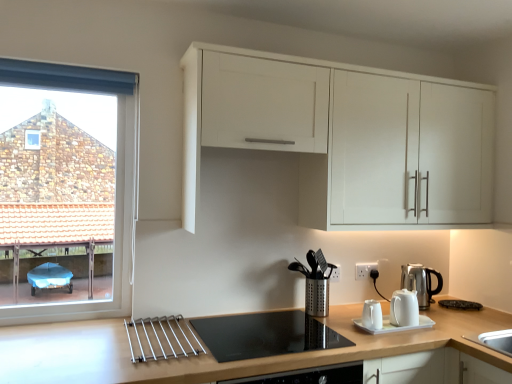
At what (x,y) coordinates should I click in order to perform the action: click on white matte cabinet at upper center. Please return your answer as a coordinate pair (x, y). Looking at the image, I should click on (346, 136).

In order to face silver metallic coffee machine at center, should I rotate leftwards or rightwards?

A 8.115 degree turn to the right will do.

What do you see at coordinates (265, 335) in the screenshot?
I see `black glass cooktop at center` at bounding box center [265, 335].

Measure the distance between point [374,264] and camera.

Point [374,264] is 2.38 meters from camera.

Locate an element on the screen. white matte cabinet at upper center is located at coordinates (346, 136).

Identify the location of the 1st kitchen appliance located above the light brown wood at lower center (from a real-world perspective). (372, 315).

Considering the sizes of objects white glossy teapot at center, the first kitchen appliance from the left, and light brown wood at lower center in the image provided, who is taller, white glossy teapot at center, the first kitchen appliance from the left, or light brown wood at lower center?

Standing taller between the two is light brown wood at lower center.

From the image's perspective, is white glossy teapot at center, the first kitchen appliance when ordered from front to back, above or below light brown wood at lower center?

Based on their image positions, white glossy teapot at center, the first kitchen appliance when ordered from front to back, is located above light brown wood at lower center.

Based on their positions, is white glossy teapot at center, the second kitchen appliance from the right, located to the left or right of light brown wood at lower center?

white glossy teapot at center, the second kitchen appliance from the right, is to the right of light brown wood at lower center.

Which is farther from the camera, (429,277) or (360,270)?

The point (360,270) is farther.

Can you confirm if silver metallic kettle at right, which is the 2th kitchen appliance in left-to-right order, is shorter than white plastic electric outlet at lower right?

Incorrect, the height of silver metallic kettle at right, which is the 2th kitchen appliance in left-to-right order, does not fall short of that of white plastic electric outlet at lower right.

From a real-world perspective, is silver metallic kettle at right, arranged as the second kitchen appliance when viewed from the front, physically above white plastic electric outlet at lower right?

No.

From the picture: Can you confirm if silver metallic kettle at right, arranged as the second kitchen appliance when viewed from the front, is smaller than white plastic electric outlet at lower right?

No, silver metallic kettle at right, arranged as the second kitchen appliance when viewed from the front, is not smaller than white plastic electric outlet at lower right.

Between white glossy teapot at center, the first kitchen appliance from the left, and white plastic electric outlet at lower right, which one appears on the left side from the viewer's perspective?

From the viewer's perspective, white glossy teapot at center, the first kitchen appliance from the left, appears more on the left side.

Does point (375, 325) lie behind point (366, 263)?

No, it is not.

Is white glossy teapot at center, the second kitchen appliance from the right, turned away from white plastic electric outlet at lower right?

That's not correct — white glossy teapot at center, the second kitchen appliance from the right, is not looking away from white plastic electric outlet at lower right.

Could you tell me if silver metallic kettle at right, arranged as the second kitchen appliance when viewed from the front, is facing silver metallic coffee machine at center?

No, silver metallic kettle at right, arranged as the second kitchen appliance when viewed from the front, does not turn towards silver metallic coffee machine at center.

Is silver metallic kettle at right, arranged as the second kitchen appliance when viewed from the front, bigger or smaller than silver metallic coffee machine at center?

silver metallic kettle at right, arranged as the second kitchen appliance when viewed from the front, is smaller than silver metallic coffee machine at center.

From the picture: Considering the relative positions of silver metallic kettle at right, which appears as the first kitchen appliance when viewed from the back, and silver metallic coffee machine at center in the image provided, is silver metallic kettle at right, which appears as the first kitchen appliance when viewed from the back, to the left of silver metallic coffee machine at center from the viewer's perspective?

No.

Looking at this image, from their relative heights in the image, would you say silver metallic kettle at right, which appears as the first kitchen appliance when viewed from the back, is taller or shorter than silver metallic coffee machine at center?

Considering their sizes, silver metallic kettle at right, which appears as the first kitchen appliance when viewed from the back, has less height than silver metallic coffee machine at center.

Consider the image. Is silver metallic kettle at right, arranged as the first kitchen appliance when viewed from the right, not inside clear glass window at left?

That's correct, silver metallic kettle at right, arranged as the first kitchen appliance when viewed from the right, is outside of clear glass window at left.

Can you tell me how much silver metallic kettle at right, which is the 2th kitchen appliance in left-to-right order, and clear glass window at left differ in facing direction?

The facing directions of silver metallic kettle at right, which is the 2th kitchen appliance in left-to-right order, and clear glass window at left are 4 degrees apart.

The height and width of the screenshot is (384, 512). I want to click on window that appears above the silver metallic kettle at right, which is the 2th kitchen appliance in left-to-right order (from the image's perspective), so tap(66, 191).

Is the depth of silver metallic kettle at right, arranged as the first kitchen appliance when viewed from the right, greater than that of clear glass window at left?

Yes, it is behind clear glass window at left.

Is black glass cooktop at center aimed at silver metallic coffee machine at center?

No, black glass cooktop at center is not facing towards silver metallic coffee machine at center.

Does point (301, 341) appear closer or farther from the camera than point (302, 264)?

Point (301, 341) is closer to the camera than point (302, 264).

Considering the relative positions of black glass cooktop at center and silver metallic coffee machine at center in the image provided, is black glass cooktop at center to the left of silver metallic coffee machine at center from the viewer's perspective?

Indeed, black glass cooktop at center is positioned on the left side of silver metallic coffee machine at center.

Considering the relative sizes of black glass cooktop at center and silver metallic coffee machine at center in the image provided, is black glass cooktop at center bigger than silver metallic coffee machine at center?

Incorrect, black glass cooktop at center is not larger than silver metallic coffee machine at center.

Is light brown wood at lower center closer to the viewer compared to white matte cabinet at upper center?

Yes, light brown wood at lower center is in front of white matte cabinet at upper center.

Are light brown wood at lower center and white matte cabinet at upper center beside each other?

There is a gap between light brown wood at lower center and white matte cabinet at upper center.

In the scene shown: Considering the relative positions of light brown wood at lower center and white matte cabinet at upper center in the image provided, is light brown wood at lower center to the right of white matte cabinet at upper center from the viewer's perspective?

No, light brown wood at lower center is not to the right of white matte cabinet at upper center.

How far apart are light brown wood at lower center and white matte cabinet at upper center?

light brown wood at lower center and white matte cabinet at upper center are 79.16 centimeters apart.

From a real-world perspective, count 1st kitchen appliances upward from the light brown wood at lower center and point to it. Please provide its 2D coordinates.

[(372, 315)]

I want to click on kitchen appliance on the right side of white plastic electric outlet at lower right, so click(421, 283).

From the image, which object appears to be farther from clear glass window at left, white plastic electric outlet at lower right or white glossy teapot at center, the first kitchen appliance from the left?

Based on the image, white plastic electric outlet at lower right appears to be further to clear glass window at left.

Which object lies nearer to the anchor point silver metallic coffee machine at center, clear glass window at left or white matte cabinet at upper center?

white matte cabinet at upper center is positioned closer to the anchor silver metallic coffee machine at center.

Based on their spatial positions, is clear glass window at left or light brown wood at lower center closer to silver metallic coffee machine at center?

The object closer to silver metallic coffee machine at center is light brown wood at lower center.

Considering their positions, is silver metallic kettle at right, arranged as the second kitchen appliance when viewed from the front, positioned further to black glass cooktop at center than light brown wood at lower center?

The object further to black glass cooktop at center is silver metallic kettle at right, arranged as the second kitchen appliance when viewed from the front.

Estimate the real-world distances between objects in this image. Which object is closer to light brown wood at lower center, clear glass window at left or white glossy teapot at center, which is the 2th kitchen appliance in back-to-front order?

white glossy teapot at center, which is the 2th kitchen appliance in back-to-front order, lies closer to light brown wood at lower center than the other object.

When comparing their distances from clear glass window at left, does white matte cabinet at upper center or white glossy teapot at center, the first kitchen appliance from the left, seem closer?

Based on the image, white matte cabinet at upper center appears to be nearer to clear glass window at left.

Consider the image. Based on their spatial positions, is white glossy teapot at center, the first kitchen appliance from the left, or silver metallic kettle at right, which is the 2th kitchen appliance in left-to-right order, further from white plastic electric outlet at lower right?

white glossy teapot at center, the first kitchen appliance from the left, lies further to white plastic electric outlet at lower right than the other object.

Considering their positions, is clear glass window at left positioned closer to light brown wood at lower center than silver metallic coffee machine at center?

silver metallic coffee machine at center is closer to light brown wood at lower center.

Locate an element on the screen. The height and width of the screenshot is (384, 512). coffee machine between white matte cabinet at upper center and light brown wood at lower center in the up-down direction is located at coordinates (315, 283).

This screenshot has height=384, width=512. I want to click on gas stove positioned between light brown wood at lower center and silver metallic kettle at right, which appears as the first kitchen appliance when viewed from the back, from near to far, so click(x=265, y=335).

Where is `coffee machine between white matte cabinet at upper center and black glass cooktop at center vertically`? coffee machine between white matte cabinet at upper center and black glass cooktop at center vertically is located at coordinates (315, 283).

In order to click on electric outlet between clear glass window at left and silver metallic kettle at right, arranged as the second kitchen appliance when viewed from the front, from left to right in this screenshot , I will do `click(364, 270)`.